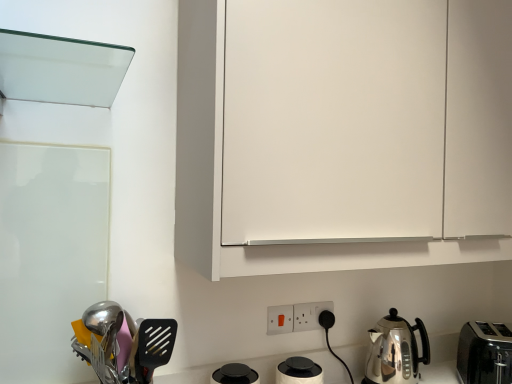
Question: In terms of size, does satin silver kettle at lower right appear bigger or smaller than polished stainless steel utensils at lower left?

Choices:
 (A) big
 (B) small

Answer: (B)

Question: From the image's perspective, is satin silver kettle at lower right above or below polished stainless steel utensils at lower left?

Choices:
 (A) above
 (B) below

Answer: (B)

Question: Which is nearer to the polished stainless steel utensils at lower left?

Choices:
 (A) white matte cabinet at upper center
 (B) white plastic electric outlet at lower center, the 1th electric outlet from the front
 (C) white plastic electric outlet at lower center, the first electric outlet when ordered from right to left
 (D) black plastic toaster at lower right
 (E) satin silver kettle at lower right

Answer: (B)

Question: Based on their relative distances, which object is nearer to the white plastic electric outlet at lower center, the first electric outlet when ordered from right to left?

Choices:
 (A) white matte cabinet at upper center
 (B) white plastic electric outlet at lower center, the 1th electric outlet from the front
 (C) black plastic toaster at lower right
 (D) polished stainless steel utensils at lower left
 (E) satin silver kettle at lower right

Answer: (B)